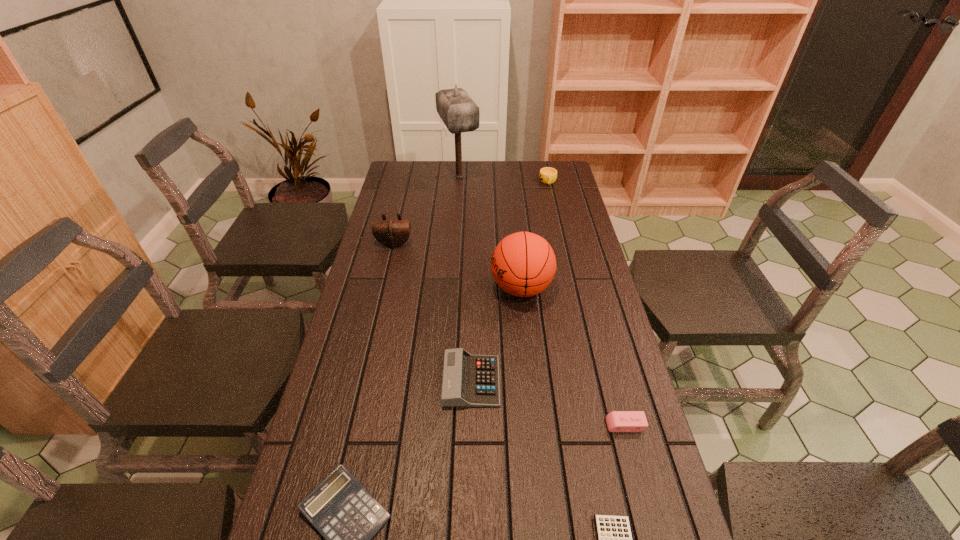
Where is `blank space located on the side with logo of the second tallest object`? This screenshot has width=960, height=540. blank space located on the side with logo of the second tallest object is located at coordinates (366, 288).

Where is `free spot located on the side with logo of the second tallest object`? Image resolution: width=960 pixels, height=540 pixels. free spot located on the side with logo of the second tallest object is located at coordinates (369, 288).

The height and width of the screenshot is (540, 960). Find the location of `free space located on the side with logo of the second tallest object`. free space located on the side with logo of the second tallest object is located at coordinates (426, 288).

Locate an element on the screen. vacant space situated with the flap open on the sixth nearest object is located at coordinates (389, 265).

The width and height of the screenshot is (960, 540). Identify the location of free space located 0.190m on the left of the cup. (494, 182).

I want to click on vacant space located 0.260m on the right of the farthest calculator, so click(x=601, y=381).

Identify the location of free space located on the left of the sixth farthest object. (474, 425).

Locate an element on the screen. mallet located at the far edge is located at coordinates (458, 111).

This screenshot has width=960, height=540. Identify the location of cup located at the far edge. (547, 175).

You are a GUI agent. You are given a task and a screenshot of the screen. Output one action in this format:
    pyautogui.click(x=<x>, y=<y>)
    Task: Click on the object that is positioned at the left edge
    
    Given the screenshot: What is the action you would take?
    pyautogui.click(x=392, y=233)